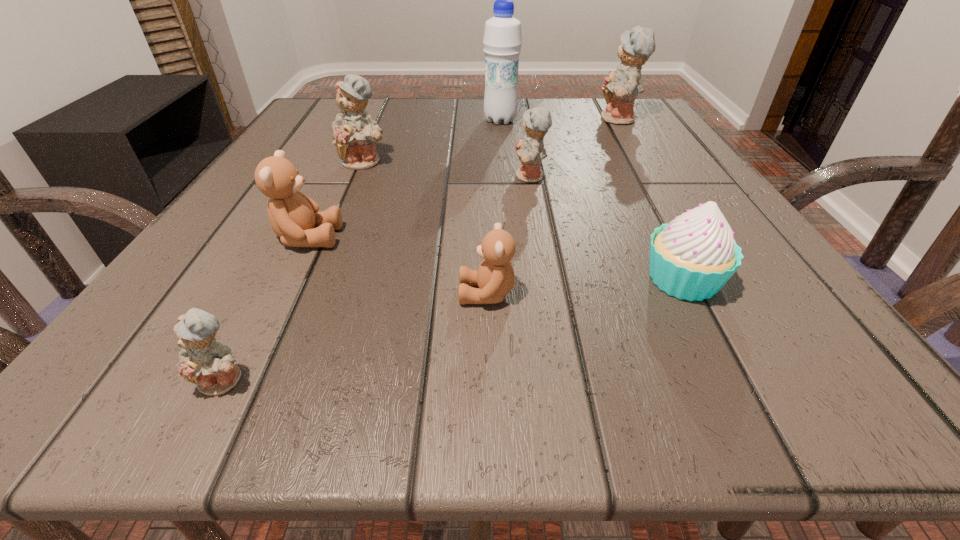
Where is `vacant area situated 0.060m on the front-facing side of the fifth teddy bear from left to right`? Image resolution: width=960 pixels, height=540 pixels. vacant area situated 0.060m on the front-facing side of the fifth teddy bear from left to right is located at coordinates (479, 177).

The height and width of the screenshot is (540, 960). In order to click on free space located 0.110m on the front-facing side of the fifth teddy bear from left to right in this screenshot , I will do `click(449, 177)`.

The height and width of the screenshot is (540, 960). What are the coordinates of `vacant space located 0.180m on the front-facing side of the fifth teddy bear from left to right` in the screenshot? It's located at [x=408, y=177].

Identify the location of vacant space located on the face of the third nearest teddy bear. The image size is (960, 540). point(432,238).

Image resolution: width=960 pixels, height=540 pixels. In order to click on free space located on the left of the cupcake in this screenshot , I will do `click(514, 280)`.

Locate an element on the screen. This screenshot has width=960, height=540. free space located on the face of the nearer brown teddy bear is located at coordinates (285, 294).

I want to click on free space located on the face of the nearer brown teddy bear, so click(x=418, y=294).

This screenshot has width=960, height=540. I want to click on free space located on the face of the nearer brown teddy bear, so click(228, 294).

Where is `water bottle situated at the far edge`? The image size is (960, 540). water bottle situated at the far edge is located at coordinates (502, 41).

Image resolution: width=960 pixels, height=540 pixels. I want to click on teddy bear located at the far edge, so click(x=620, y=88).